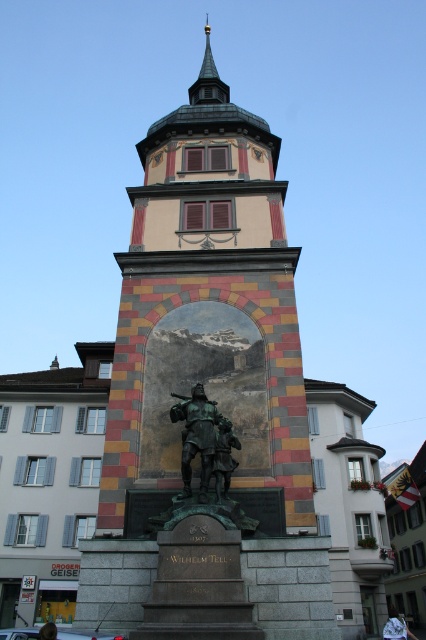
You are a tourist standing in the town square and want to take a photo of the multicolored stone tower at center and the gold spire at upper center. Which object is positioned higher in the image?

The gold spire at upper center is positioned higher in the image than the multicolored stone tower at center.

You are standing in the town square and want to take a photo of the multicolored stone tower at center. Your camera has a maximum focus range of 100 feet. Will you be able to capture the tower clearly?

The multicolored stone tower at center is 97.37 feet away from the viewer. Since the camera can focus up to 100 feet, you can capture the tower clearly.

You are an architect visiting the monument and want to place a new decorative element between the bronze statue at center and the gold spire at upper center. Considering their sizes, which one should the element be closer to to maintain visual balance?

The bronze statue at center is smaller than the gold spire at upper center, so the decorative element should be placed closer to the bronze statue at center to balance the visual weight.